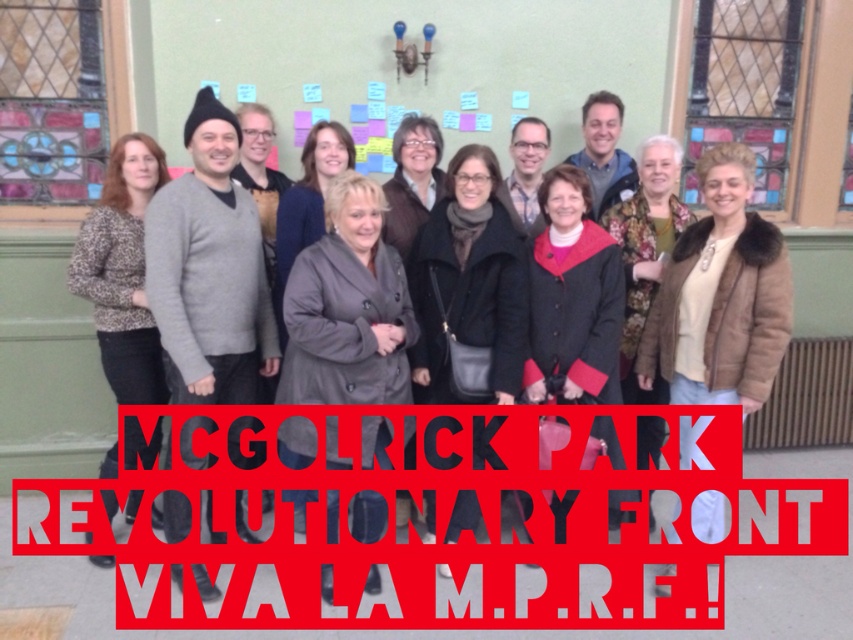
You are standing in the center of the room and want to place a new object exactly where the black plastic sign at center is currently located. According to the coordinates provided, where should you place the new object?

The black plastic sign at center is located at coordinates point (434,525), so you should place the new object at point (434,525).